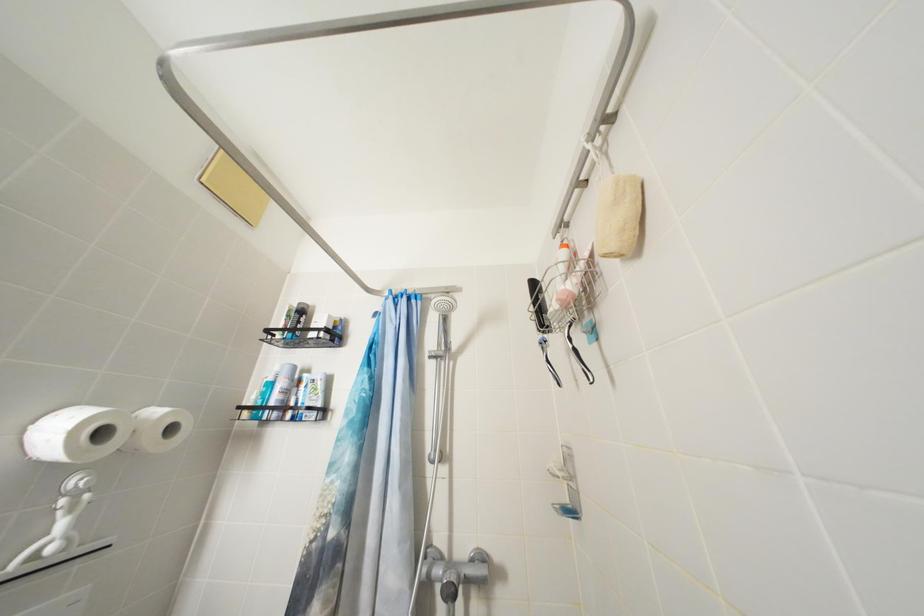
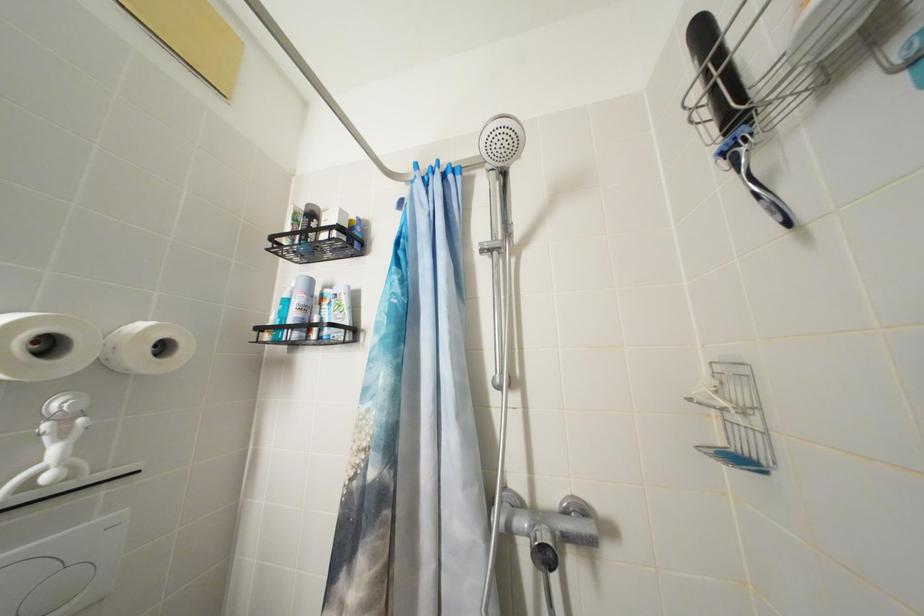
Question: Which direction would the cameraman need to move to produce the second image? Reply with the corresponding letter.

Choices:
 (A) Left
 (B) Right
 (C) Forward
 (D) Backward

Answer: (C)